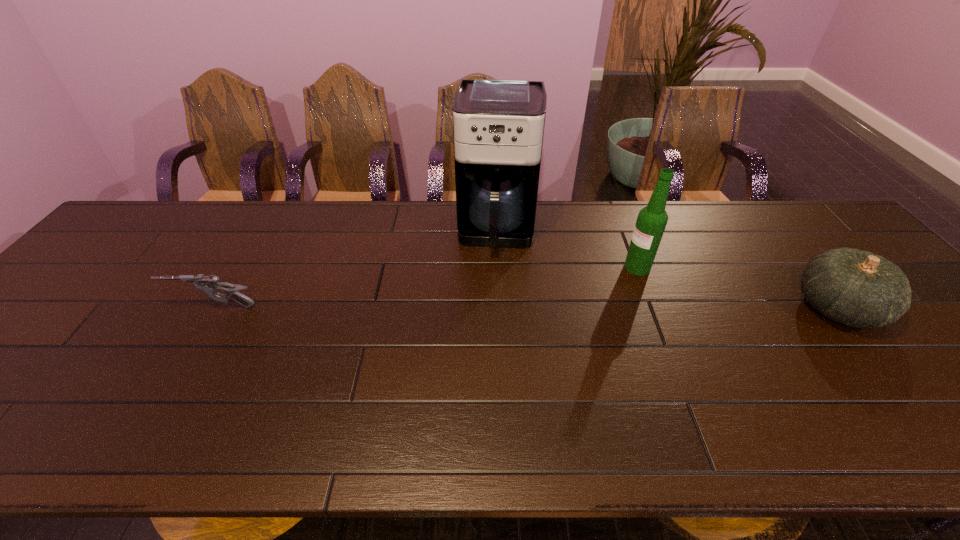
Locate an element on the screen. Image resolution: width=960 pixels, height=540 pixels. the shortest object is located at coordinates (209, 285).

In order to click on the leftmost object in this screenshot , I will do `click(209, 285)`.

The height and width of the screenshot is (540, 960). Identify the location of gourd. (857, 288).

At what (x,y) coordinates should I click in order to perform the action: click on the rightmost object. Please return your answer as a coordinate pair (x, y). Image resolution: width=960 pixels, height=540 pixels. Looking at the image, I should click on (857, 288).

The image size is (960, 540). Identify the location of the tallest object. (498, 124).

At what (x,y) coordinates should I click in order to perform the action: click on coffee maker. Please return your answer as a coordinate pair (x, y). The height and width of the screenshot is (540, 960). Looking at the image, I should click on (498, 124).

Identify the location of beer bottle. The height and width of the screenshot is (540, 960). (651, 221).

Where is `the second object from right to left`? The height and width of the screenshot is (540, 960). the second object from right to left is located at coordinates (651, 221).

I want to click on vacant region located 0.260m at the barrel of the shortest object, so click(x=69, y=307).

At what (x,y) coordinates should I click in order to perform the action: click on vacant space located at the barrel of the shortest object. Please return your answer as a coordinate pair (x, y). The width and height of the screenshot is (960, 540). Looking at the image, I should click on (148, 307).